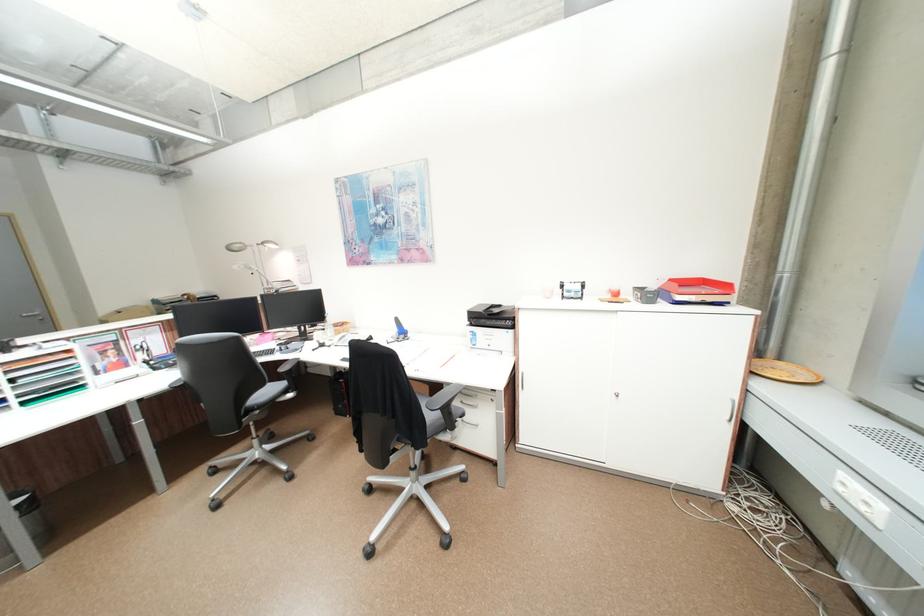
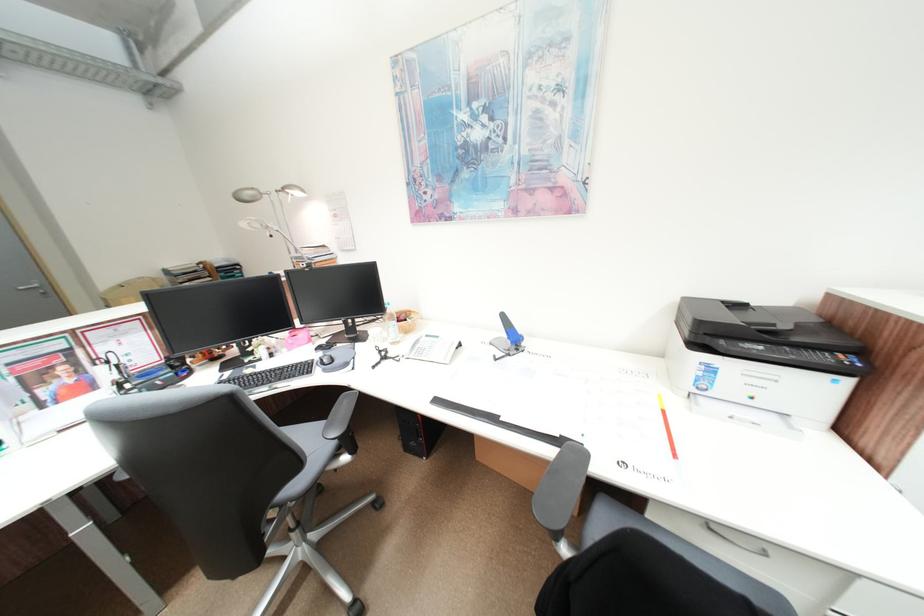
In a continuous first-person perspective shot, in which direction is the camera moving?

The cameraman walked toward left, forward.